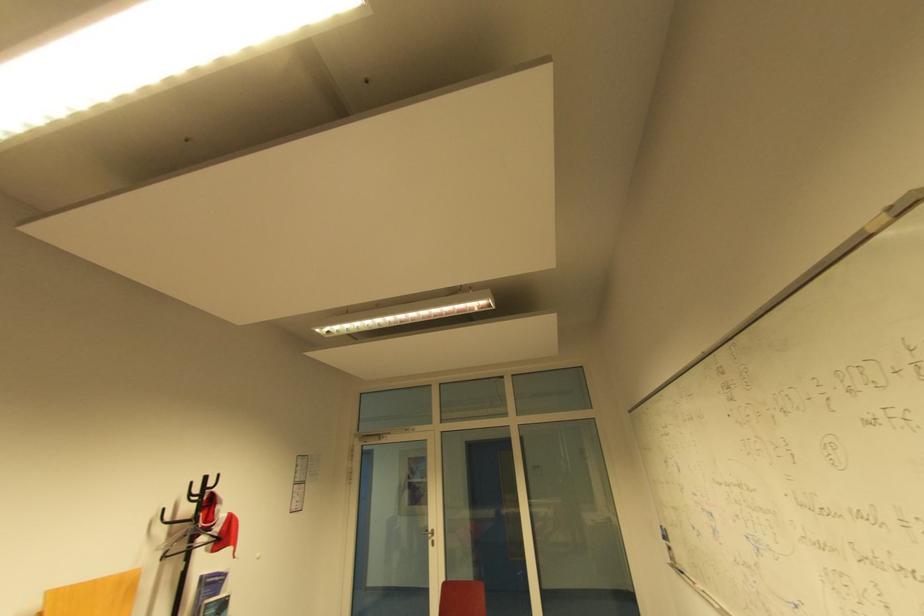
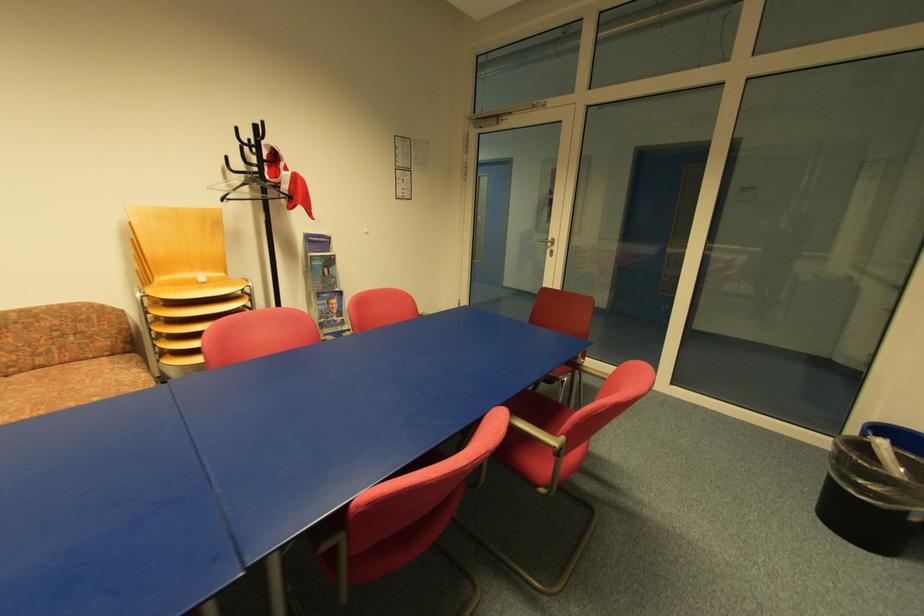
Locate, in the second image, the point that corresponds to the point at 432,532 in the first image.

(551, 241)